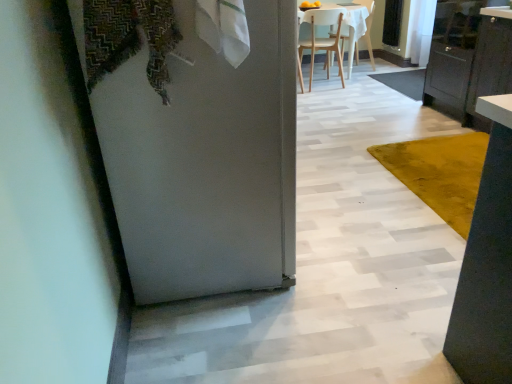
Question: In terms of width, does yellow velvet rug at center look wider or thinner when compared to clear glass screen door at upper right?

Choices:
 (A) thin
 (B) wide

Answer: (B)

Question: Relative to clear glass screen door at upper right, is yellow velvet rug at center in front or behind?

Choices:
 (A) front
 (B) behind

Answer: (A)

Question: Considering the real-world distances, which object is closest to the black glossy cabinet at right?

Choices:
 (A) white matte chair at upper center, the 2th chair when ordered from right to left
 (B) yellow velvet rug at center
 (C) white matte door at left
 (D) patterned fabric laundry at upper left
 (E) clear glass screen door at upper right

Answer: (B)

Question: Estimate the real-world distances between objects in this image. Which object is farther from the yellow velvet rug at center?

Choices:
 (A) white matte chair at upper center, the first chair in the left-to-right sequence
 (B) clear glass screen door at upper right
 (C) black glossy cabinet at right
 (D) wooden chair at upper center, positioned as the second chair in left-to-right order
 (E) patterned fabric laundry at upper left

Answer: (B)